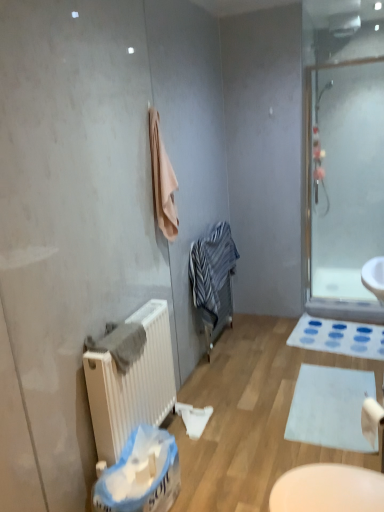
Question: From a real-world perspective, is blue plastic laundry basket at lower center below beige soft towel at upper center, the second bath towel ordered from the bottom?

Choices:
 (A) yes
 (B) no

Answer: (A)

Question: Is blue plastic laundry basket at lower center aimed at beige soft towel at upper center, which ranks as the 2th bath towel in front-to-back order?

Choices:
 (A) no
 (B) yes

Answer: (A)

Question: Can you confirm if blue plastic laundry basket at lower center is smaller than beige soft towel at upper center, which is counted as the first bath towel, starting from the right?

Choices:
 (A) no
 (B) yes

Answer: (A)

Question: Is beige soft towel at upper center, which ranks as the 2th bath towel in front-to-back order, at the back of blue plastic laundry basket at lower center?

Choices:
 (A) no
 (B) yes

Answer: (A)

Question: Considering the relative sizes of blue plastic laundry basket at lower center and beige soft towel at upper center, the second bath towel ordered from the bottom, in the image provided, is blue plastic laundry basket at lower center shorter than beige soft towel at upper center, the second bath towel ordered from the bottom,?

Choices:
 (A) no
 (B) yes

Answer: (B)

Question: Do you think striped cotton bathrobe at center is within white matte radiator at lower left, or outside of it?

Choices:
 (A) outside
 (B) inside

Answer: (A)

Question: Considering the relative positions of striped cotton bathrobe at center and white matte radiator at lower left in the image provided, is striped cotton bathrobe at center to the left or to the right of white matte radiator at lower left?

Choices:
 (A) left
 (B) right

Answer: (B)

Question: From their relative heights in the image, would you say striped cotton bathrobe at center is taller or shorter than white matte radiator at lower left?

Choices:
 (A) tall
 (B) short

Answer: (B)

Question: In terms of width, does striped cotton bathrobe at center look wider or thinner when compared to white matte radiator at lower left?

Choices:
 (A) thin
 (B) wide

Answer: (B)

Question: Which is correct: white matte toilet paper at lower right is inside gray cotton towel at left, placed as the second bath towel when sorted from right to left, or outside of it?

Choices:
 (A) inside
 (B) outside

Answer: (B)

Question: From the image's perspective, is white matte toilet paper at lower right above or below gray cotton towel at left, acting as the first bath towel starting from the front?

Choices:
 (A) below
 (B) above

Answer: (A)

Question: Considering the relative positions of white matte toilet paper at lower right and gray cotton towel at left, positioned as the 2th bath towel in top-to-bottom order, in the image provided, is white matte toilet paper at lower right to the left or to the right of gray cotton towel at left, positioned as the 2th bath towel in top-to-bottom order,?

Choices:
 (A) left
 (B) right

Answer: (B)

Question: From a real-world perspective, is white matte toilet paper at lower right physically located above or below gray cotton towel at left, which is counted as the 1th bath towel, starting from the bottom?

Choices:
 (A) above
 (B) below

Answer: (B)

Question: From a real-world perspective, relative to white fabric bath mat at lower right, placed as the 1th bath mat when sorted from back to front, is striped cotton bathrobe at center vertically above or below?

Choices:
 (A) above
 (B) below

Answer: (A)

Question: Is striped cotton bathrobe at center wider or thinner than white fabric bath mat at lower right, placed as the 1th bath mat when sorted from back to front?

Choices:
 (A) wide
 (B) thin

Answer: (B)